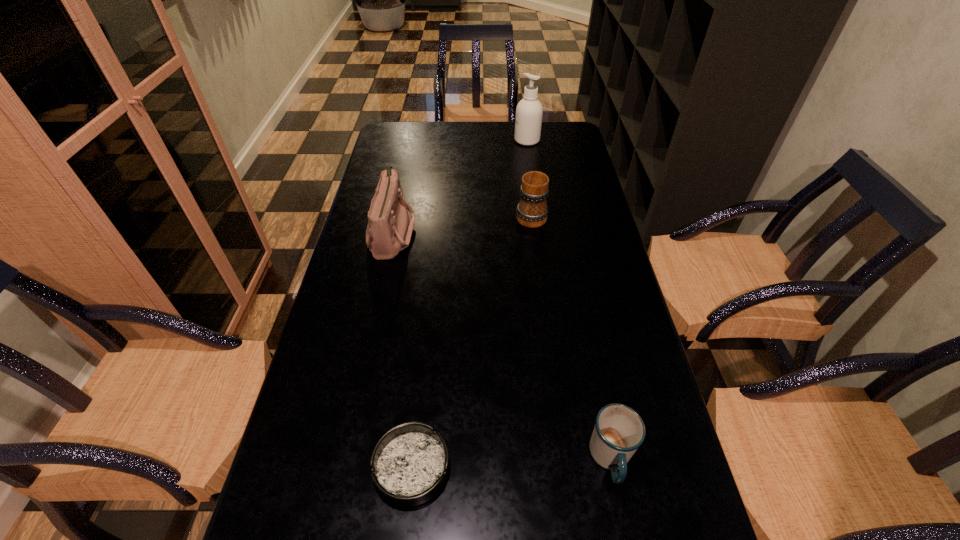
Locate an element on the screen. This screenshot has height=540, width=960. mug that is at the right edge is located at coordinates (619, 431).

Where is `object at the far right corner`? Image resolution: width=960 pixels, height=540 pixels. object at the far right corner is located at coordinates (529, 111).

Find the location of a particular element. The image size is (960, 540). free location at the far edge is located at coordinates (446, 134).

Image resolution: width=960 pixels, height=540 pixels. In the image, there is a desktop. In order to click on blank space at the left edge in this screenshot , I will do `click(363, 308)`.

The width and height of the screenshot is (960, 540). What are the coordinates of `free space at the right edge` in the screenshot? It's located at click(x=653, y=494).

Locate an element on the screen. The image size is (960, 540). vacant space at the far left corner of the desktop is located at coordinates (418, 124).

The image size is (960, 540). Find the location of `empty location between the nearer mug and the tallest object`. empty location between the nearer mug and the tallest object is located at coordinates (569, 299).

This screenshot has height=540, width=960. I want to click on free spot between the shoulder bag and the nearer mug, so click(x=501, y=346).

Where is `free space that is in between the farther mug and the second shortest object`? The image size is (960, 540). free space that is in between the farther mug and the second shortest object is located at coordinates (571, 336).

What are the coordinates of `free area in between the farthest object and the shoulder bag` in the screenshot? It's located at (460, 186).